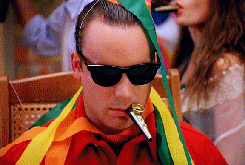
At what (x,y) coordinates should I click in order to perform the action: click on chair. Please return your answer as a coordinate pair (x, y). Looking at the image, I should click on (52, 94).